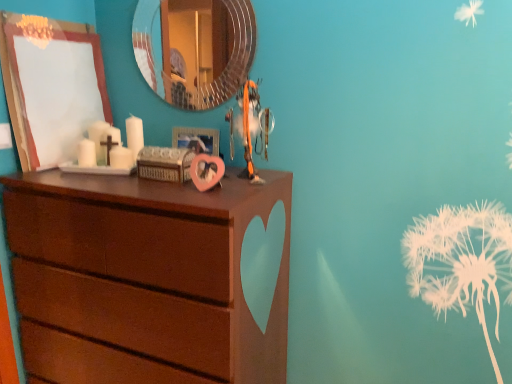
Question: From a real-world perspective, is orange fabric toy at center physically located above or below metallic circular mirror at upper center?

Choices:
 (A) above
 (B) below

Answer: (B)

Question: Considering the positions of orange fabric toy at center and metallic circular mirror at upper center in the image, is orange fabric toy at center bigger or smaller than metallic circular mirror at upper center?

Choices:
 (A) big
 (B) small

Answer: (A)

Question: Which is nearer to the metallic circular mirror at upper center?

Choices:
 (A) wooden picture frame at upper left, which is the first picture frame from left to right
 (B) brown wood chest of drawers at left
 (C) orange fabric toy at center
 (D) pink matte heart-shaped frame at center, arranged as the 2th picture frame when viewed from the left

Answer: (A)

Question: Estimate the real-world distances between objects in this image. Which object is closer to the wooden picture frame at upper left, which is the first picture frame from left to right?

Choices:
 (A) brown wood chest of drawers at left
 (B) metallic circular mirror at upper center
 (C) orange fabric toy at center
 (D) pink matte heart-shaped frame at center, arranged as the 2th picture frame when viewed from the left

Answer: (D)